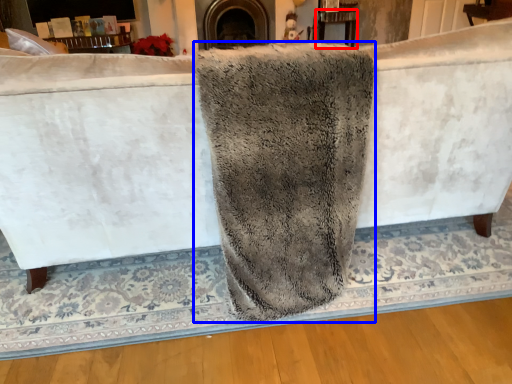
Question: Which of the following is the farthest to the observer, table (highlighted by a red box) or bath towel (highlighted by a blue box)?

Choices:
 (A) table
 (B) bath towel

Answer: (A)